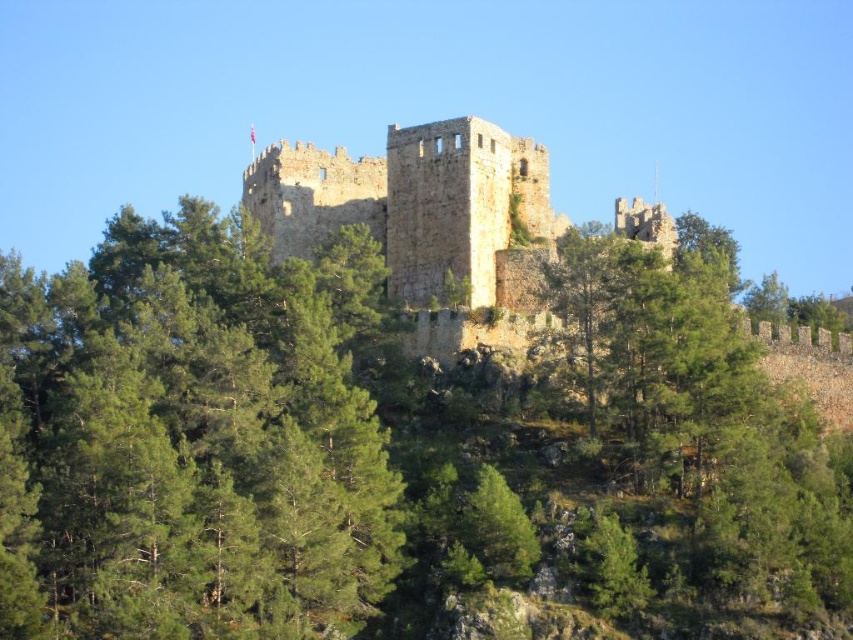
You are a drone operator tasked with capturing aerial footage of the historic castle. Your drone must fly from the green leafy tree at center to the flagpole on the tower. According to the coordinates provided, which direction should the drone move to reach the flagpole?

The green leafy tree at center is located at coordinates point [189,440]. The flagpole on the tower is part of the castle structure, which is situated at the top of the hill. Since the castle is on the hill and the tree is in the foreground, the drone should move upward and towards the hilltop to reach the flagpole.

You are a bird looking for a place to perch. You see the green leafy tree at center and the brown stone castle at center. Which location would allow you to see farther into the distance?

The green leafy tree at center is much taller than the brown stone castle at center, so perching on the green leafy tree at center would allow you to see farther into the distance.

You are standing in a forest and see both the green leafy tree at center and the brown stone castle at center. Which object is nearer to you?

The green leafy tree at center is closer to the viewer than the brown stone castle at center.